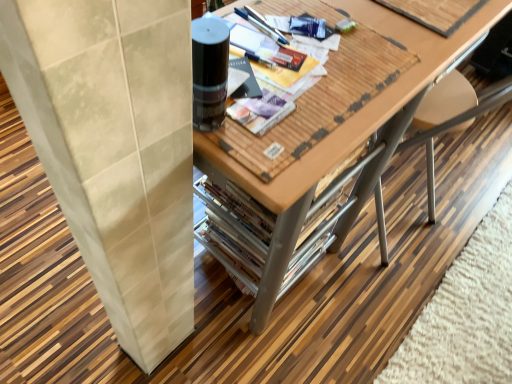
Question: From a real-world perspective, is wooden magazine at upper right, which is counted as the first magazine, starting from the right, above or below matte black magazine at center, marked as the first magazine in a bottom-to-top arrangement?

Choices:
 (A) below
 (B) above

Answer: (A)

Question: Is wooden magazine at upper right, the 2th magazine from the bottom, inside or outside of matte black magazine at center, which ranks as the 1th magazine in left-to-right order?

Choices:
 (A) outside
 (B) inside

Answer: (A)

Question: Considering the real-world distances, which object is farthest from the matte black magazine at center, the 2th magazine positioned from the right?

Choices:
 (A) wooden magazine at upper right, the 2th magazine from the bottom
 (B) wooden table at center

Answer: (A)

Question: Based on their relative distances, which object is nearer to the wooden table at center?

Choices:
 (A) matte black magazine at center, arranged as the second magazine when viewed from the top
 (B) wooden magazine at upper right, which is counted as the first magazine, starting from the right

Answer: (B)